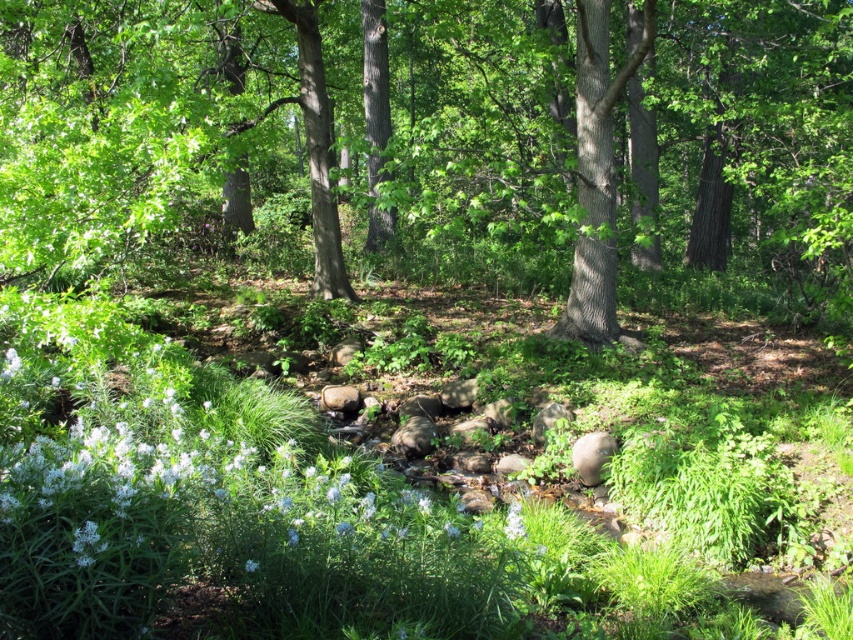
Can you confirm if smooth bark tree at center is positioned below white matte flower at lower center?

Incorrect, smooth bark tree at center is not positioned below white matte flower at lower center.

Is smooth bark tree at center closer to the viewer compared to white matte flower at lower center?

No, it is behind white matte flower at lower center.

Image resolution: width=853 pixels, height=640 pixels. Find the location of `smooth bark tree at center`. smooth bark tree at center is located at coordinates (596, 173).

Does green leafy tree at center have a greater height compared to white matte flower at lower center?

Indeed, green leafy tree at center has a greater height compared to white matte flower at lower center.

Which is above, green leafy tree at center or white matte flower at lower center?

green leafy tree at center is higher up.

Image resolution: width=853 pixels, height=640 pixels. In order to click on green leafy tree at center in this screenshot , I will do `click(438, 147)`.

In the scene shown: Is white matte flower at center shorter than white matte flower at lower center?

No, white matte flower at center is not shorter than white matte flower at lower center.

Does white matte flower at center have a greater height compared to white matte flower at lower center?

Yes.

Does point (515, 525) come in front of point (253, 568)?

That is False.

The width and height of the screenshot is (853, 640). Identify the location of white matte flower at center. coord(514,522).